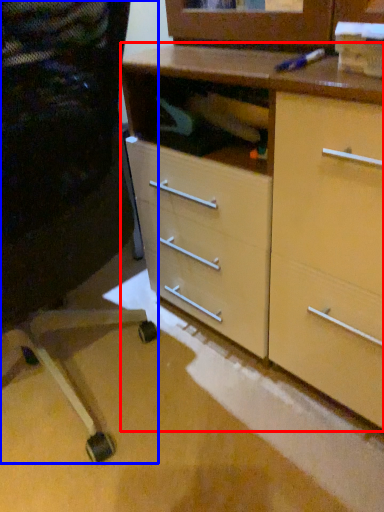
Question: Which object appears farthest to the camera in this image, chest of drawers (highlighted by a red box) or computer chair (highlighted by a blue box)?

Choices:
 (A) chest of drawers
 (B) computer chair

Answer: (A)